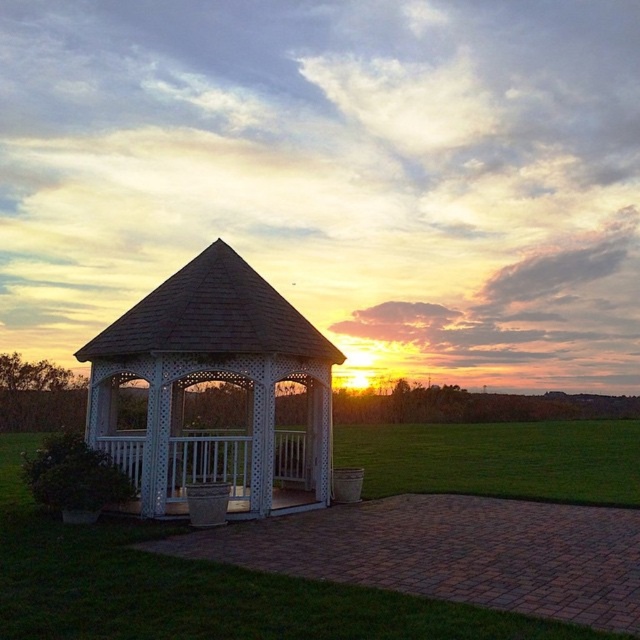
You are standing on the green grass at center and want to walk to the white lattice gazebo at center. Which direction should you move to get closer to the gazebo?

Since the green grass at center is closer to the viewer than the white lattice gazebo at center, you should move backward to reach the gazebo.